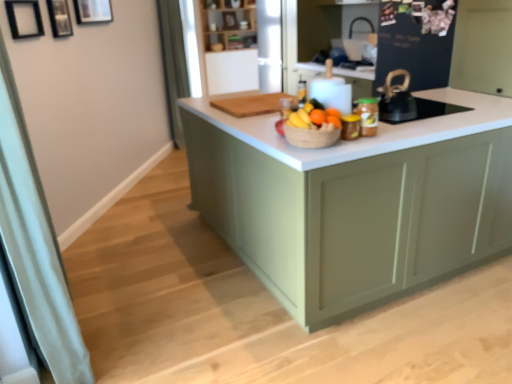
Describe the element at coordinates (24, 18) in the screenshot. The height and width of the screenshot is (384, 512). I see `black matte picture frame at upper left, positioned as the 1th picture frame in front-to-back order` at that location.

Locate an element on the screen. translucent glass bottle at center is located at coordinates (302, 93).

Where is `wooden shelves at upper center`? wooden shelves at upper center is located at coordinates (x=229, y=24).

What is the approximate width of green fabric curtain at left, acting as the 1th curtain starting from the back?

15.30 centimeters.

Where is `green fabric curtain at left, which is the second curtain in bottom-to-top order`? Image resolution: width=512 pixels, height=384 pixels. green fabric curtain at left, which is the second curtain in bottom-to-top order is located at coordinates (173, 64).

Image resolution: width=512 pixels, height=384 pixels. Find the location of `white fabric curtain at left, marked as the first curtain in a bottom-to-top arrangement`. white fabric curtain at left, marked as the first curtain in a bottom-to-top arrangement is located at coordinates (35, 245).

Considering the positions of objects black matte kettle at upper right and orange matte at center, marked as the 2th orange in a left-to-right arrangement, in the image provided, who is behind, black matte kettle at upper right or orange matte at center, marked as the 2th orange in a left-to-right arrangement,?

black matte kettle at upper right is more distant.

Is black matte kettle at upper right outside of orange matte at center, which appears as the first orange when viewed from the right?

Yes, black matte kettle at upper right is not within orange matte at center, which appears as the first orange when viewed from the right.

Can you tell me how much black matte kettle at upper right and orange matte at center, marked as the 2th orange in a left-to-right arrangement, differ in facing direction?

There is a 180-degree angle between the facing directions of black matte kettle at upper right and orange matte at center, marked as the 2th orange in a left-to-right arrangement.

Considering the relative sizes of orange matte at center, which is counted as the first orange, starting from the back, and orange matte at center, which appears as the 1th orange when viewed from the left, in the image provided, is orange matte at center, which is counted as the first orange, starting from the back, thinner than orange matte at center, which appears as the 1th orange when viewed from the left,?

In fact, orange matte at center, which is counted as the first orange, starting from the back, might be wider than orange matte at center, which appears as the 1th orange when viewed from the left.

Is orange matte at center, which is counted as the first orange, starting from the back, positioned with its back to orange matte at center, which appears as the first orange when viewed from the front?

orange matte at center, which is counted as the first orange, starting from the back, does not have its back to orange matte at center, which appears as the first orange when viewed from the front.

Which of these two, orange matte at center, which appears as the first orange when viewed from the right, or orange matte at center, which appears as the first orange when viewed from the front, is bigger?

With larger size is orange matte at center, which appears as the first orange when viewed from the right.

Is point (325, 111) positioned before point (322, 110)?

That is True.

Considering the relative positions of orange matte at center, which is counted as the first orange, starting from the back, and translucent glass bottle at center in the image provided, is orange matte at center, which is counted as the first orange, starting from the back, to the left or to the right of translucent glass bottle at center?

Clearly, orange matte at center, which is counted as the first orange, starting from the back, is on the right of translucent glass bottle at center in the image.

Is orange matte at center, arranged as the 2th orange when viewed from the front, oriented away from translucent glass bottle at center?

Correct, orange matte at center, arranged as the 2th orange when viewed from the front, is looking away from translucent glass bottle at center.

How different are the orientations of orange matte at center, which is counted as the first orange, starting from the back, and translucent glass bottle at center in degrees?

The angle between the facing direction of orange matte at center, which is counted as the first orange, starting from the back, and the facing direction of translucent glass bottle at center is 180 degrees.

How distant is orange matte at center, arranged as the 2th orange when viewed from the front, from translucent glass bottle at center?

The distance of orange matte at center, arranged as the 2th orange when viewed from the front, from translucent glass bottle at center is 9.66 inches.

From the picture: Can you tell me how much wooden picture frame at upper left, marked as the 2th picture frame in a back-to-front arrangement, and orange matte at center differ in facing direction?

wooden picture frame at upper left, marked as the 2th picture frame in a back-to-front arrangement, and orange matte at center are facing 56.5 degrees away from each other.

Could you tell me if wooden picture frame at upper left, marked as the 2th picture frame in a back-to-front arrangement, is facing orange matte at center?

No.

Which point is more forward, (52, 11) or (330, 118)?

The point (330, 118) is closer to the camera.

Consider the image. Considering the positions of objects wooden picture frame at upper left, which ranks as the 2th picture frame in front-to-back order, and orange matte at center in the image provided, who is more to the right, wooden picture frame at upper left, which ranks as the 2th picture frame in front-to-back order, or orange matte at center?

orange matte at center is more to the right.

Considering the positions of points (387, 272) and (55, 8), is point (387, 272) farther from camera compared to point (55, 8)?

No, it is not.

How far apart are matte green cabinet at center and wooden picture frame at upper left, which ranks as the 2th picture frame in front-to-back order?

Result: matte green cabinet at center and wooden picture frame at upper left, which ranks as the 2th picture frame in front-to-back order, are 2.16 meters apart.

Which of these two, matte green cabinet at center or wooden picture frame at upper left, which ranks as the 2th picture frame in front-to-back order, is wider?

matte green cabinet at center is wider.

From a real-world perspective, starting from the wooden picture frame at upper left, marked as the 2th picture frame in a back-to-front arrangement, which curtain is the 2nd one below it? Please provide its 2D coordinates.

[(35, 245)]

From the image's perspective, which one is positioned higher, white fabric curtain at left, the second curtain when ordered from top to bottom, or wooden picture frame at upper left, marked as the 2th picture frame in a back-to-front arrangement?

wooden picture frame at upper left, marked as the 2th picture frame in a back-to-front arrangement.

Is point (39, 182) closer or farther from the camera than point (62, 27)?

Point (39, 182).

Looking at this image, from the image's perspective, is orange matte at center, the 2th orange in the back-to-front sequence, above orange matte at center?

Indeed, from the image's perspective, orange matte at center, the 2th orange in the back-to-front sequence, is shown above orange matte at center.

Is orange matte at center, the 2th orange in the back-to-front sequence, facing away from orange matte at center?

No, orange matte at center, the 2th orange in the back-to-front sequence,'s orientation is not away from orange matte at center.

Considering the relative sizes of orange matte at center, the 2th orange from the right, and orange matte at center in the image provided, is orange matte at center, the 2th orange from the right, wider than orange matte at center?

Yes.

What's the angular difference between orange matte at center, which appears as the first orange when viewed from the front, and orange matte at center's facing directions?

The angle between the facing direction of orange matte at center, which appears as the first orange when viewed from the front, and the facing direction of orange matte at center is 0.000772 degrees.

The height and width of the screenshot is (384, 512). In order to click on appliance behind the orange matte at center, which appears as the first orange when viewed from the right in this screenshot , I will do `click(397, 99)`.

In the image, there is a orange matte at center, which appears as the first orange when viewed from the front. Identify the location of orange above it (from the image's perspective). (333, 113).

When comparing their distances from black matte kettle at upper right, does wooden shelves at upper center or wooden picture frame at upper left, which ranks as the 2th picture frame in front-to-back order, seem further?

wooden shelves at upper center.

Considering their positions, is metallic silver jar at center positioned further to green fabric curtain at left, acting as the 1th curtain starting from the back, than bright yellow bananas at center?

bright yellow bananas at center.

From the image, which object appears to be farther from black matte kettle at upper right, translucent glass bottle at center or metallic silver jar at center?

Among the two, translucent glass bottle at center is located further to black matte kettle at upper right.

Based on their spatial positions, is bright yellow bananas at center or orange matte at center closer to white fabric curtain at left, which appears as the first curtain when viewed from the front?

Based on the image, bright yellow bananas at center appears to be nearer to white fabric curtain at left, which appears as the first curtain when viewed from the front.

Considering their positions, is orange matte at center, which appears as the 1th orange when viewed from the left, positioned further to wooden picture frame at upper left, which appears as the 3th picture frame when viewed from the front, than black matte kettle at upper right?

Based on the image, black matte kettle at upper right appears to be further to wooden picture frame at upper left, which appears as the 3th picture frame when viewed from the front.

Looking at the image, which one is located further to white fabric curtain at left, the second curtain when ordered from top to bottom, orange matte at center, the 2th orange in the back-to-front sequence, or black matte kettle at upper right?

black matte kettle at upper right.

Considering their positions, is translucent glass bottle at center positioned closer to matte green cabinet at center than black matte kettle at upper right?

black matte kettle at upper right is closer to matte green cabinet at center.

Considering their positions, is green fabric curtain at left, which is the second curtain in bottom-to-top order, positioned further to white fabric curtain at left, which appears as the first curtain when viewed from the front, than black matte kettle at upper right?

green fabric curtain at left, which is the second curtain in bottom-to-top order, lies further to white fabric curtain at left, which appears as the first curtain when viewed from the front, than the other object.

You are a GUI agent. You are given a task and a screenshot of the screen. Output one action in this format:
    pyautogui.click(x=<x>, y=<y>)
    Task: Click on the tangerine situated between translucent glass bottle at center and black matte kettle at upper right from left to right
    This screenshot has height=384, width=512.
    Given the screenshot: What is the action you would take?
    pyautogui.click(x=333, y=121)

Find the location of a particular element. This screenshot has width=512, height=384. fruit between white fabric curtain at left, positioned as the second curtain in back-to-front order, and black matte kettle at upper right, in the horizontal direction is located at coordinates (315, 118).

Find the location of `appliance positioned between matte green cabinet at center and wooden shelves at upper center from near to far`. appliance positioned between matte green cabinet at center and wooden shelves at upper center from near to far is located at coordinates (397, 99).

Find the location of a particular element. The image size is (512, 384). bottle located between orange matte at center and green fabric curtain at left, which is the second curtain in bottom-to-top order, in the depth direction is located at coordinates (302, 93).